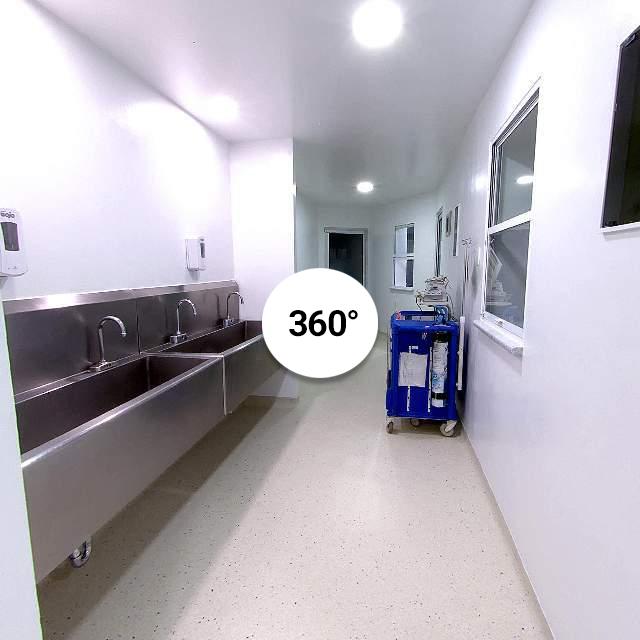
Find the location of a particular element. tile floor is located at coordinates (296, 509).